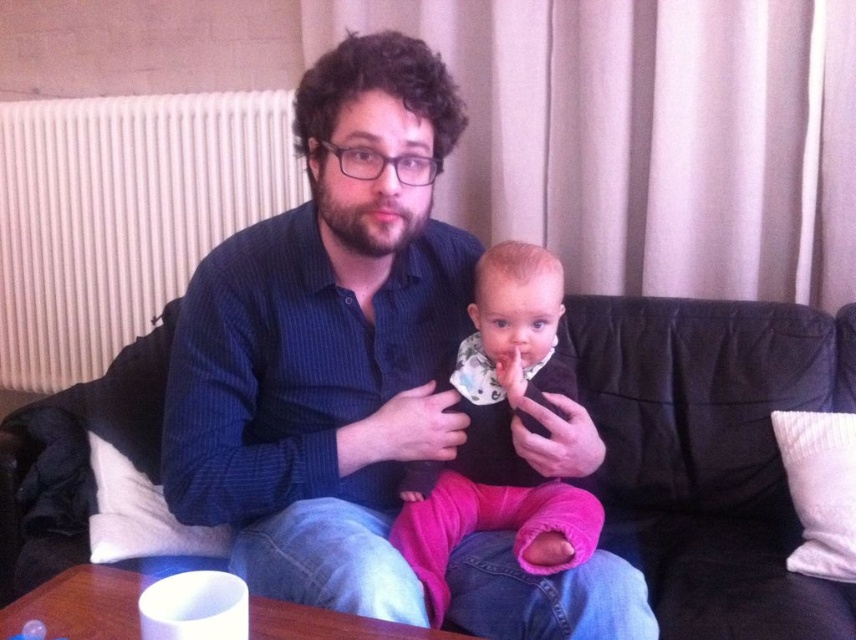
You are standing in the living room and want to move from the point at coordinates point (836,380) to the point at coordinates point (535,508). Which direction should you move to get closer to your destination?

To move from point (836,380) to point (535,508), you should move northeast because the destination point has a higher x coordinate and a lower y coordinate, indicating a northeast direction.

You are a fashion designer observing the image. You need to decide which item of clothing, the blue striped shirt at center or the pink fleece pants at center, would require more fabric to create. Based on their appearance in the image, which one do you think needs more material?

The blue striped shirt at center might be wider than pink fleece pants at center, so it likely requires more fabric to make.

You are a photographer adjusting your camera to focus on two points in the scene. The first point is at coordinates point (325, 397) and the second is at point (489, 392). Which point should you focus on to ensure it appears sharper in the photo?

Point (325, 397) is closer to the camera than point (489, 392), so focusing on point (325, 397) will make it appear sharper in the photo.